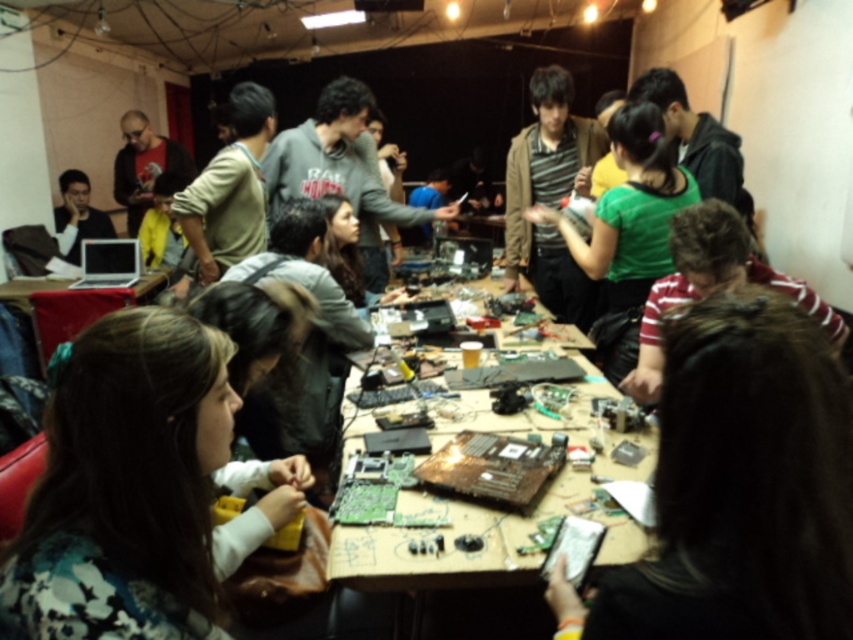
You are a photographer setting up for an event in this workshop. You need to position a spotlight so it shines on both the black matte hair at upper right and the matte wooden table at center. Given their positions, will the light hit both objects if placed above the table?

The black matte hair at upper right is below the matte wooden table at center, so placing the spotlight above the table would cast light downward, illuminating both the table and the hair below it.

You are organizing a workshop and need to place a decorative cloth over the wooden table at center. The cloth you have is the same size as the floral fabric shirt at lower left. Will the cloth be sufficient to cover the table?

The floral fabric shirt at lower left is narrower than the wooden table at center, so the cloth of the same size as the floral fabric shirt at lower left will not be sufficient to cover the wooden table at center.

You are standing at the entrance of the workshop and want to locate the black matte hair at upper right and the matte wooden table at center. Which object is positioned to the right side of the other?

The black matte hair at upper right is to the right of the matte wooden table at center, so the black matte hair at upper right is positioned to the right of the matte wooden table at center.